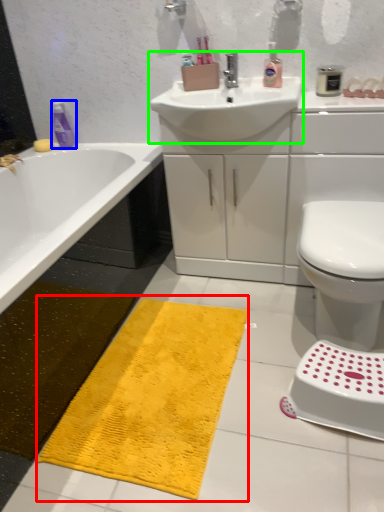
Question: Which object is positioned farthest from bath mat (highlighted by a red box)? Select from mouthwash (highlighted by a blue box) and sink (highlighted by a green box).

Choices:
 (A) mouthwash
 (B) sink

Answer: (A)